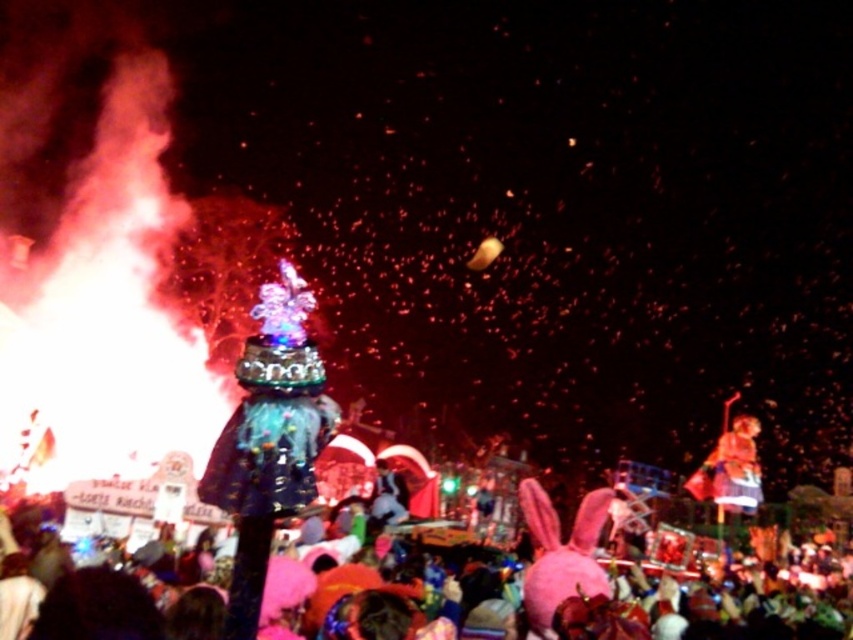
The width and height of the screenshot is (853, 640). Identify the location of pink fabric crowd at lower center. (552, 595).

Is pink fabric crowd at lower center thinner than shiny gold statue at right?

No.

Which is behind, point (326, 632) or point (711, 474)?

Point (711, 474)

Identify the location of pink fabric crowd at lower center. This screenshot has height=640, width=853. (552, 595).